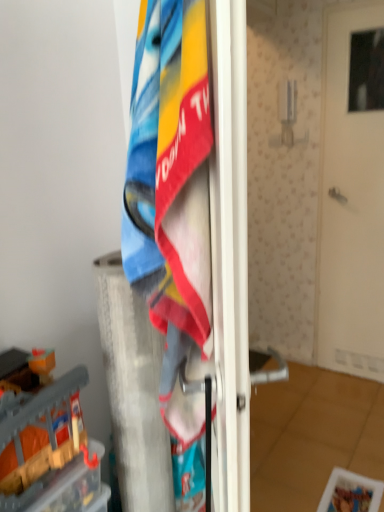
Question: In the image, is white matte door at center on the left side or the right side of white textured pillar at center?

Choices:
 (A) right
 (B) left

Answer: (A)

Question: From their relative heights in the image, would you say white matte door at center is taller or shorter than white textured pillar at center?

Choices:
 (A) short
 (B) tall

Answer: (B)

Question: Estimate the real-world distances between objects in this image. Which object is farther from the wooden block at left?

Choices:
 (A) white textured pillar at center
 (B) white matte door at center
 (C) textured cotton towel at center

Answer: (B)

Question: Based on their relative distances, which object is nearer to the white matte door at center?

Choices:
 (A) textured cotton towel at center
 (B) white textured pillar at center
 (C) wooden block at left

Answer: (B)